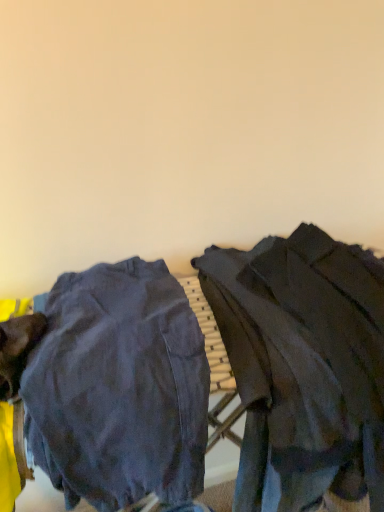
Question: From a real-world perspective, is dark denim pants at center above or below dark gray fabric jacket at right?

Choices:
 (A) below
 (B) above

Answer: (A)

Question: Considering their positions, is dark denim pants at center located in front of or behind dark gray fabric jacket at right?

Choices:
 (A) behind
 (B) front

Answer: (B)

Question: Is dark denim pants at center taller or shorter than dark gray fabric jacket at right?

Choices:
 (A) tall
 (B) short

Answer: (B)

Question: In terms of width, does dark gray fabric jacket at right look wider or thinner when compared to dark denim pants at center?

Choices:
 (A) thin
 (B) wide

Answer: (B)

Question: Considering their positions, is dark gray fabric jacket at right located in front of or behind dark denim pants at center?

Choices:
 (A) behind
 (B) front

Answer: (A)

Question: From the image's perspective, is dark gray fabric jacket at right positioned above or below dark denim pants at center?

Choices:
 (A) above
 (B) below

Answer: (A)

Question: In the image, is dark gray fabric jacket at right on the left side or the right side of dark denim pants at center?

Choices:
 (A) left
 (B) right

Answer: (B)